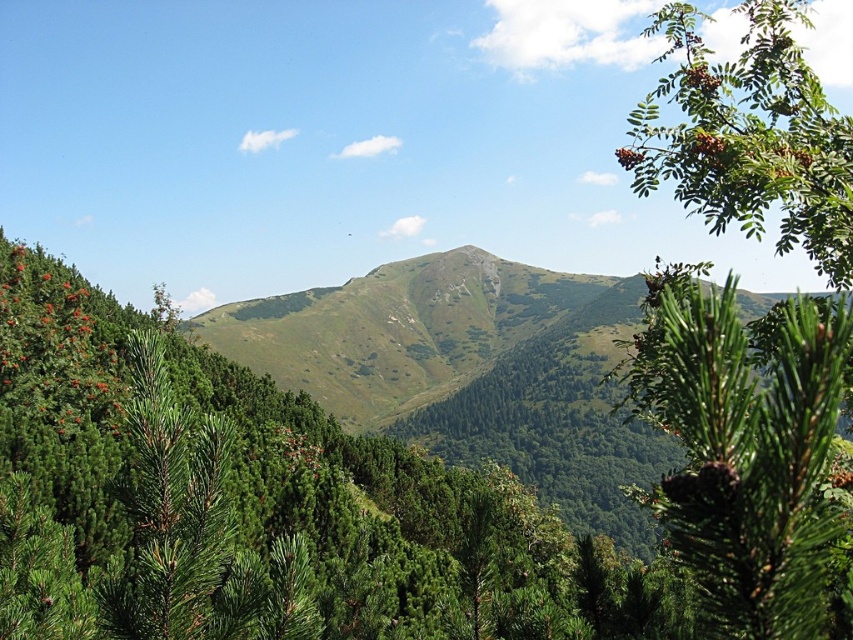
Question: Can you confirm if green needle-like tree at center is wider than green matte pine cone at upper right?

Choices:
 (A) no
 (B) yes

Answer: (B)

Question: Which point is farther to the camera?

Choices:
 (A) (688, 500)
 (B) (109, 310)

Answer: (B)

Question: Does green needle-like tree at center have a lesser width compared to green matte pine cone at upper right?

Choices:
 (A) yes
 (B) no

Answer: (B)

Question: Among these points, which one is farthest from the camera?

Choices:
 (A) (701, 104)
 (B) (144, 419)

Answer: (A)

Question: Considering the relative positions of green needle-like tree at center and green matte pine cone at upper right in the image provided, where is green needle-like tree at center located with respect to green matte pine cone at upper right?

Choices:
 (A) below
 (B) above

Answer: (A)